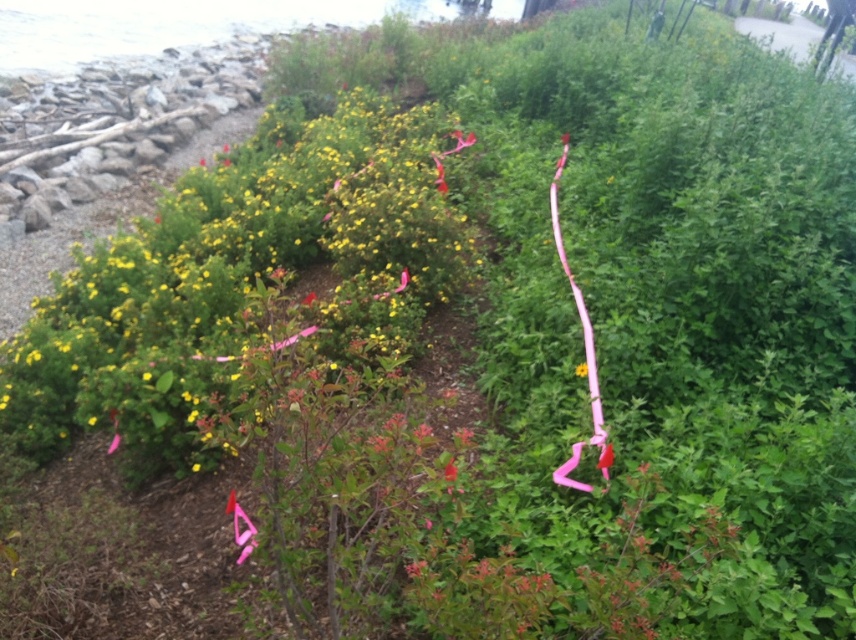
Question: Does yellow matte flower at center-left have a larger size compared to pink silky ribbon at center-right?

Choices:
 (A) yes
 (B) no

Answer: (A)

Question: Which point is farther to the camera?

Choices:
 (A) (557, 248)
 (B) (203, 451)

Answer: (A)

Question: Observing the image, what is the correct spatial positioning of yellow matte flower at center-left in reference to pink silky ribbon at center-right?

Choices:
 (A) left
 (B) right

Answer: (A)

Question: Among these points, which one is farthest from the camera?

Choices:
 (A) (239, 236)
 (B) (597, 392)

Answer: (A)

Question: Which point is farther to the camera?

Choices:
 (A) (557, 234)
 (B) (308, 129)

Answer: (B)

Question: From the image, what is the correct spatial relationship of yellow matte flower at center-left in relation to pink silky ribbon at center-right?

Choices:
 (A) below
 (B) above

Answer: (B)